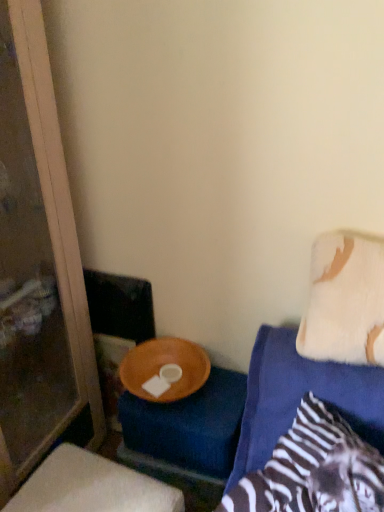
The height and width of the screenshot is (512, 384). What do you see at coordinates (38, 266) in the screenshot? I see `transparent glass screen door at left` at bounding box center [38, 266].

The height and width of the screenshot is (512, 384). In order to click on wooden bowl at lower center in this screenshot , I will do `click(91, 487)`.

This screenshot has width=384, height=512. Describe the element at coordinates (345, 300) in the screenshot. I see `white fluffy pillow at upper right` at that location.

At what (x,y) coordinates should I click in order to perform the action: click on transparent glass screen door at left. Please return your answer as a coordinate pair (x, y). The image size is (384, 512). Looking at the image, I should click on (38, 266).

Which is behind, point (7, 60) or point (35, 486)?

The point (7, 60) is more distant.

Consider the image. From a real-world perspective, is transparent glass screen door at left physically above wooden bowl at lower center?

Yes, from a real-world perspective, transparent glass screen door at left is over wooden bowl at lower center

Consider the image. Is transparent glass screen door at left positioned beyond the bounds of wooden bowl at lower center?

transparent glass screen door at left is positioned outside wooden bowl at lower center.

Is transparent glass screen door at left thinner than wooden bowl at lower center?

In fact, transparent glass screen door at left might be wider than wooden bowl at lower center.

Which is behind, point (52, 217) or point (301, 321)?

The point (52, 217) is farther.

Who is more distant, transparent glass screen door at left or white fluffy pillow at upper right?

white fluffy pillow at upper right is behind.

You are a GUI agent. You are given a task and a screenshot of the screen. Output one action in this format:
    pyautogui.click(x=<x>, y=<y>)
    Task: Click on the pillow above the transparent glass screen door at left (from the image's perspective)
    This screenshot has height=512, width=384.
    Given the screenshot: What is the action you would take?
    pyautogui.click(x=345, y=300)

Can you confirm if transparent glass screen door at left is smaller than white fluffy pillow at upper right?

Incorrect, transparent glass screen door at left is not smaller in size than white fluffy pillow at upper right.

Is white fluffy pillow at upper right to the left or to the right of wooden bowl at lower center in the image?

white fluffy pillow at upper right is to the right of wooden bowl at lower center.

Are white fluffy pillow at upper right and wooden bowl at lower center far apart?

No, white fluffy pillow at upper right is in close proximity to wooden bowl at lower center.

How many degrees apart are the facing directions of white fluffy pillow at upper right and wooden bowl at lower center?

They differ by 3.33 degrees in their facing directions.

Can you confirm if white fluffy pillow at upper right is wider than wooden bowl at lower center?

In fact, white fluffy pillow at upper right might be narrower than wooden bowl at lower center.

How much distance is there between wooden bowl at lower center and transparent glass screen door at left?

17.31 inches.

Which is behind, wooden bowl at lower center or transparent glass screen door at left?

wooden bowl at lower center.

Is wooden bowl at lower center touching transparent glass screen door at left?

No, wooden bowl at lower center is not with transparent glass screen door at left.

Does wooden bowl at lower center appear on the left side of transparent glass screen door at left?

No, wooden bowl at lower center is not to the left of transparent glass screen door at left.

Is wooden bowl at lower center oriented towards white fluffy pillow at upper right?

No.

Between wooden bowl at lower center and white fluffy pillow at upper right, which one has smaller size?

Smaller between the two is white fluffy pillow at upper right.

Is wooden bowl at lower center with white fluffy pillow at upper right?

They are not placed beside each other.

At what (x,y) coordinates should I click in order to perform the action: click on pillow above the wooden bowl at lower center (from a real-world perspective). Please return your answer as a coordinate pair (x, y). This screenshot has height=512, width=384. Looking at the image, I should click on (345, 300).

Is white fluffy pillow at upper right to the right of transparent glass screen door at left from the viewer's perspective?

Correct, you'll find white fluffy pillow at upper right to the right of transparent glass screen door at left.

Image resolution: width=384 pixels, height=512 pixels. I want to click on pillow positioned vertically above the transparent glass screen door at left (from a real-world perspective), so click(345, 300).

Does white fluffy pillow at upper right lie in front of transparent glass screen door at left?

No, white fluffy pillow at upper right is further to the viewer.

Measure the distance between white fluffy pillow at upper right and transparent glass screen door at left.

white fluffy pillow at upper right and transparent glass screen door at left are 35.64 inches apart.

At what (x,y) coordinates should I click in order to perform the action: click on furniture that appears on the right of transparent glass screen door at left. Please return your answer as a coordinate pair (x, y). The height and width of the screenshot is (512, 384). Looking at the image, I should click on (91, 487).

In the image, there is a white fluffy pillow at upper right. At what (x,y) coordinates should I click in order to perform the action: click on screen door below it (from a real-world perspective). Please return your answer as a coordinate pair (x, y). The height and width of the screenshot is (512, 384). Looking at the image, I should click on (38, 266).

When comparing their distances from transparent glass screen door at left, does wooden bowl at lower center or white fluffy pillow at upper right seem closer?

wooden bowl at lower center.

Based on their spatial positions, is transparent glass screen door at left or white fluffy pillow at upper right further from wooden bowl at lower center?

white fluffy pillow at upper right lies further to wooden bowl at lower center than the other object.

Looking at the image, which one is located closer to white fluffy pillow at upper right, transparent glass screen door at left or wooden bowl at lower center?

wooden bowl at lower center is closer to white fluffy pillow at upper right.

Estimate the real-world distances between objects in this image. Which object is closer to white fluffy pillow at upper right, wooden bowl at lower center or transparent glass screen door at left?

wooden bowl at lower center is positioned closer to the anchor white fluffy pillow at upper right.

Estimate the real-world distances between objects in this image. Which object is closer to transparent glass screen door at left, white fluffy pillow at upper right or wooden bowl at lower center?

Based on the image, wooden bowl at lower center appears to be nearer to transparent glass screen door at left.

When comparing their distances from wooden bowl at lower center, does white fluffy pillow at upper right or transparent glass screen door at left seem further?

Based on the image, white fluffy pillow at upper right appears to be further to wooden bowl at lower center.

At what (x,y) coordinates should I click in order to perform the action: click on furniture located between transparent glass screen door at left and white fluffy pillow at upper right in the left-right direction. Please return your answer as a coordinate pair (x, y). Looking at the image, I should click on (x=91, y=487).